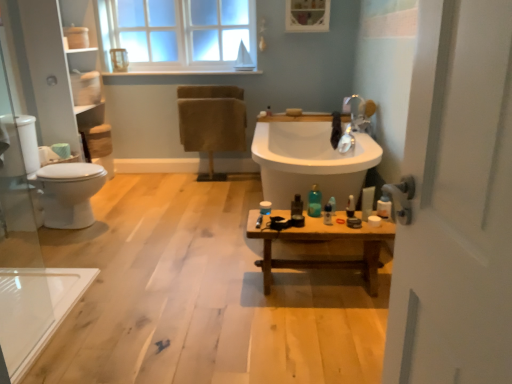
The width and height of the screenshot is (512, 384). Identify the location of free spot to the right of transparent glass door at left. (75, 346).